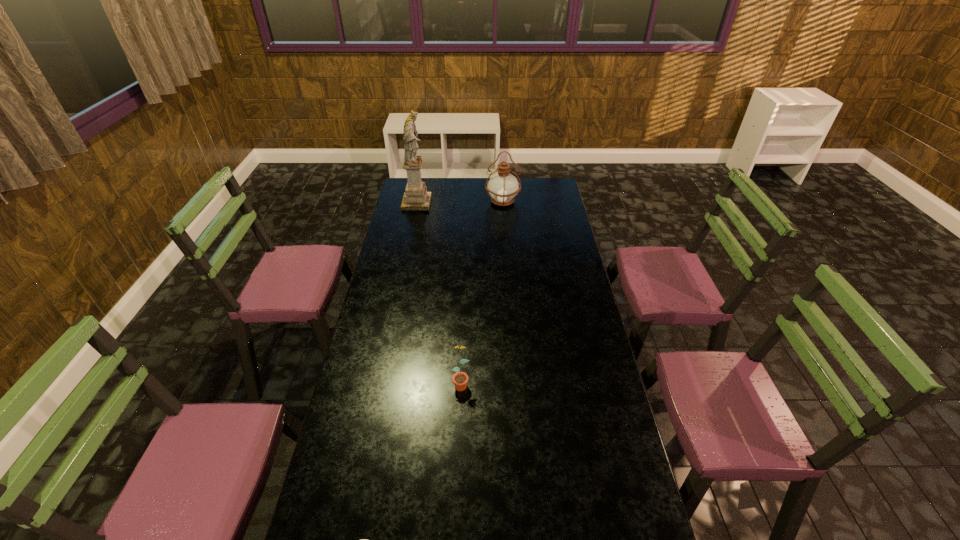
Image resolution: width=960 pixels, height=540 pixels. In order to click on sculpture in this screenshot , I will do `click(416, 197)`.

Where is `oil lamp`? oil lamp is located at coordinates (503, 187).

I want to click on the rightmost object, so click(x=503, y=187).

Locate an element on the screen. This screenshot has width=960, height=540. the second shortest object is located at coordinates (460, 379).

You are a GUI agent. You are given a task and a screenshot of the screen. Output one action in this format:
    pyautogui.click(x=<x>, y=<y>)
    Task: Click on the second object from right to left
    
    Given the screenshot: What is the action you would take?
    pyautogui.click(x=460, y=379)

The image size is (960, 540). What are the coordinates of `free region located on the front-facing side of the tallest object` in the screenshot? It's located at (478, 203).

This screenshot has height=540, width=960. What are the coordinates of `vacant point located 0.060m on the left of the oil lamp` in the screenshot? It's located at (474, 201).

Locate an element on the screen. Image resolution: width=960 pixels, height=540 pixels. vacant space located on the flower of the sunflower is located at coordinates pyautogui.click(x=459, y=434).

The height and width of the screenshot is (540, 960). I want to click on sculpture that is at the far edge, so click(x=416, y=197).

This screenshot has height=540, width=960. I want to click on oil lamp at the far edge, so click(503, 187).